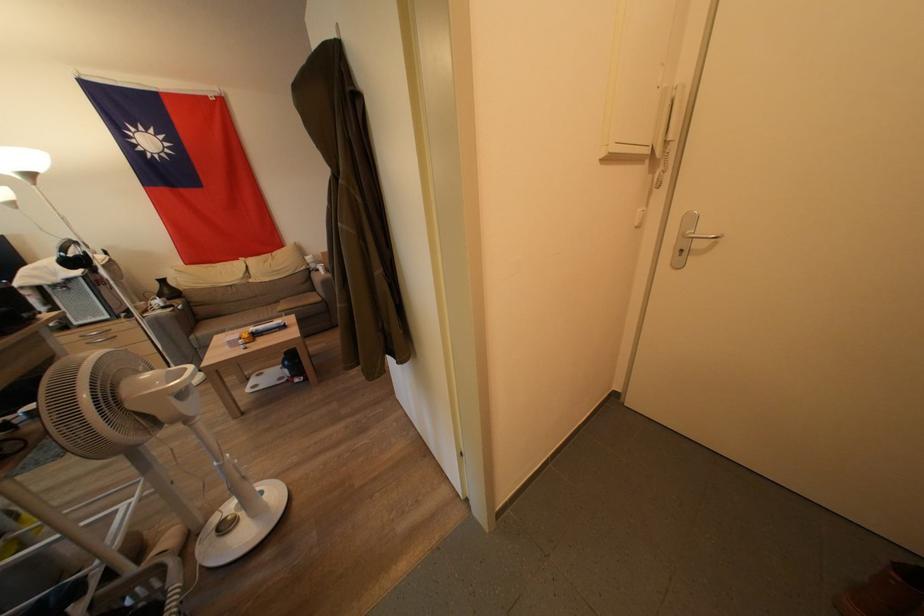
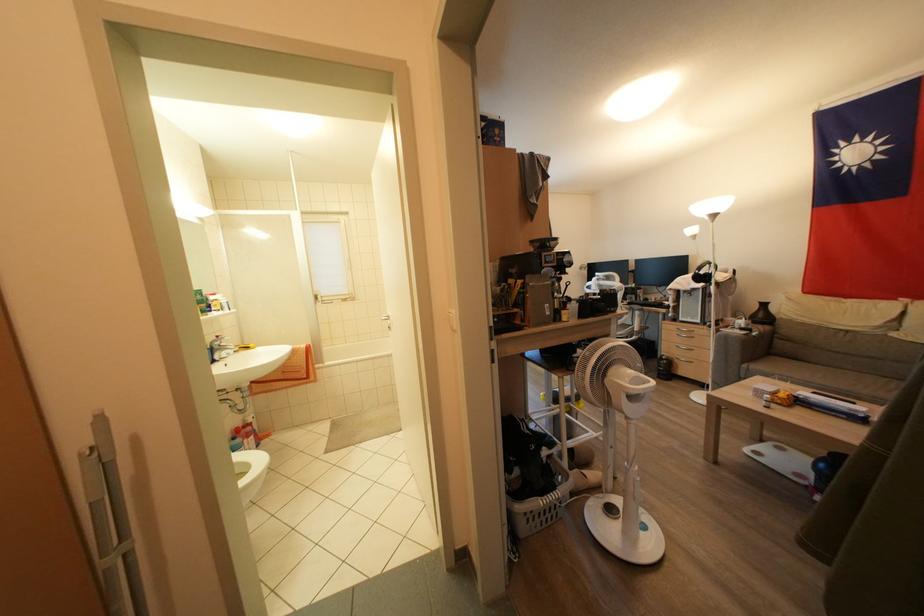
Where in the second image is the point corresponding to the point at 172,296 from the first image?

(766, 320)